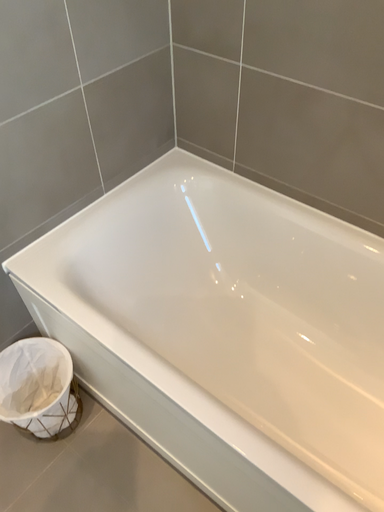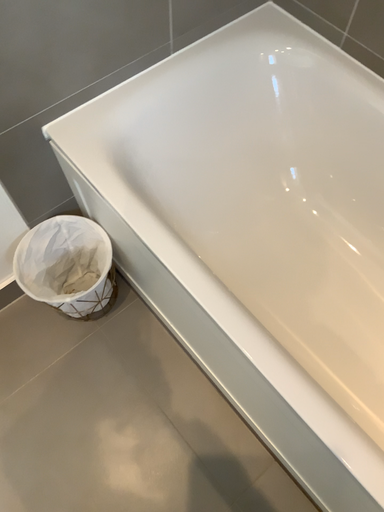
Question: How did the camera likely rotate when shooting the video?

Choices:
 (A) rotated downward
 (B) rotated upward

Answer: (A)